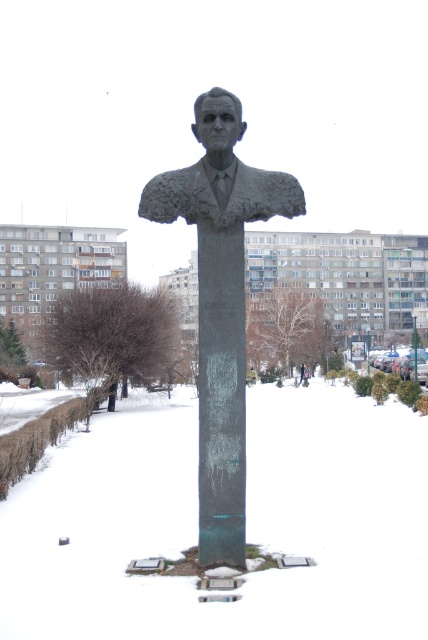
Question: Which of these objects is positioned closest to the white frosty snow at center?

Choices:
 (A) bronze statue at center
 (B) green patina bust at center

Answer: (B)

Question: Is white frosty snow at center positioned at the back of green patina bust at center?

Choices:
 (A) no
 (B) yes

Answer: (A)

Question: Does green patina bust at center appear over bronze statue at center?

Choices:
 (A) no
 (B) yes

Answer: (A)

Question: Is the position of green patina bust at center less distant than that of bronze statue at center?

Choices:
 (A) yes
 (B) no

Answer: (A)

Question: Which point is farther to the camera?

Choices:
 (A) bronze statue at center
 (B) green patina bust at center

Answer: (A)

Question: Which object appears closest to the camera in this image?

Choices:
 (A) white frosty snow at center
 (B) bronze statue at center

Answer: (A)